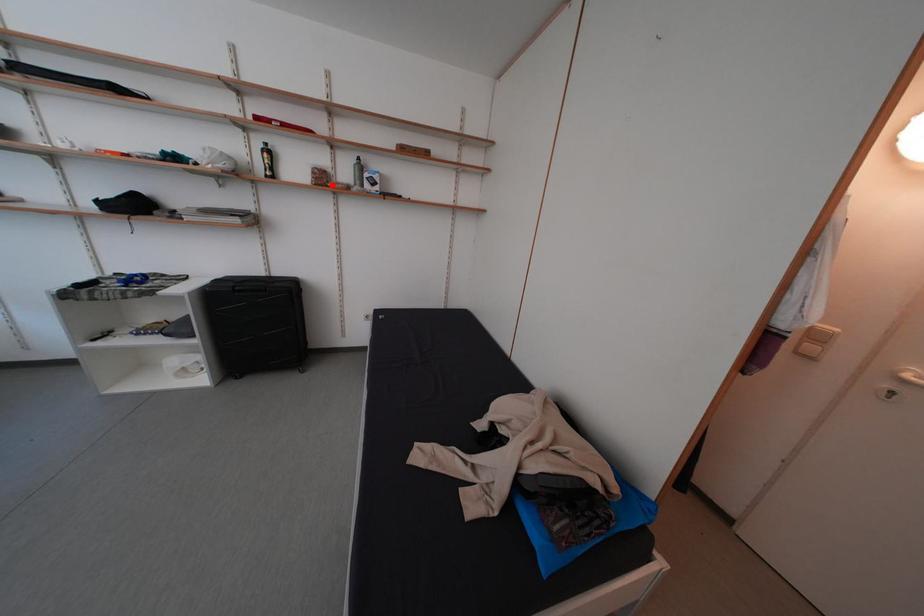
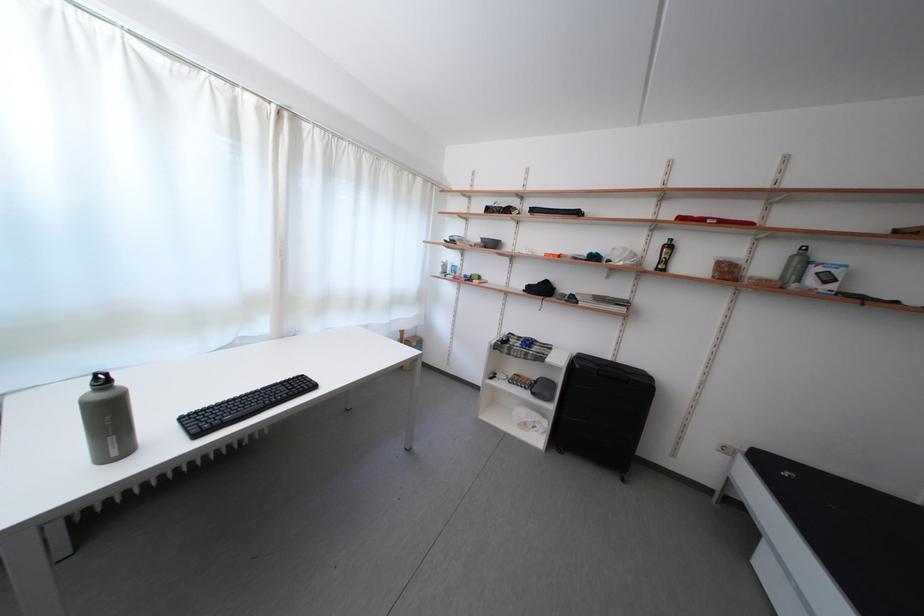
Question: I am providing you with two images of the same scene from different viewpoints. Given a red point in image1, look at the same physical point in image2. Is it:

Choices:
 (A) Closer to the viewpoint
 (B) Farther from the viewpoint

Answer: (B)